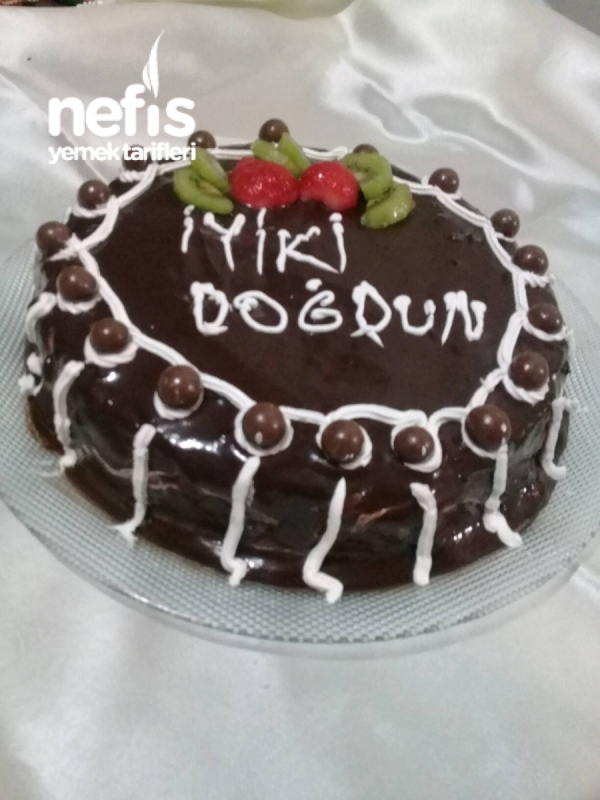
Identify the location of bottom edge of plate. This screenshot has width=600, height=800. (161, 612), (558, 574).